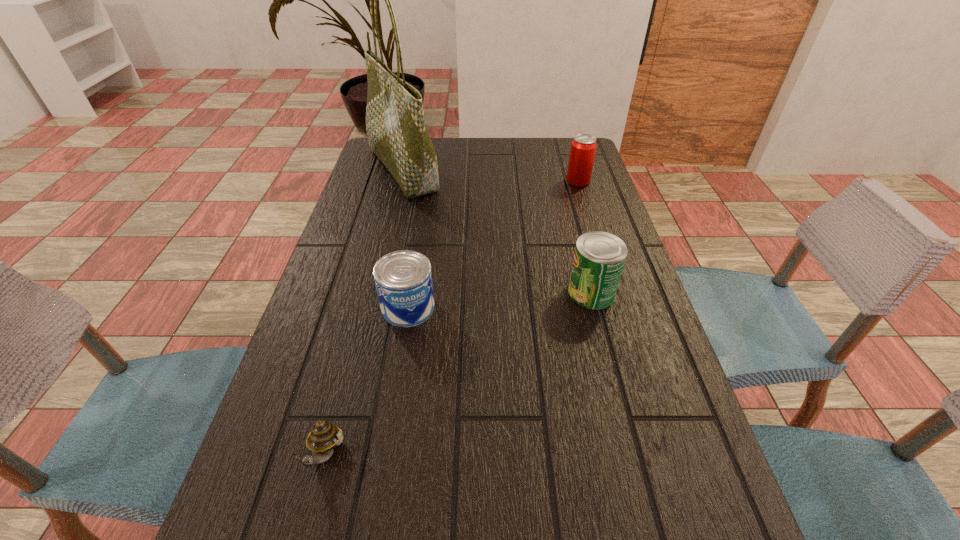
You are a GUI agent. You are given a task and a screenshot of the screen. Output one action in this format:
    pyautogui.click(x=<x>, y=<y>)
    Task: Click on the free space between the tallest object and the farthest can
    The width and height of the screenshot is (960, 540).
    Given the screenshot: What is the action you would take?
    pyautogui.click(x=491, y=175)

The height and width of the screenshot is (540, 960). I want to click on vacant point located between the farthest can and the tallest object, so click(x=491, y=175).

Identify the location of object that can be found as the closest to the shortest can. (324, 436).

Find the location of a particular element. The height and width of the screenshot is (540, 960). object that stands as the closest to the tallest object is located at coordinates (403, 279).

Where is `can that is the closest to the leftmost can`? The height and width of the screenshot is (540, 960). can that is the closest to the leftmost can is located at coordinates (599, 257).

Where is `can that stands as the second closest to the shortest can`? The width and height of the screenshot is (960, 540). can that stands as the second closest to the shortest can is located at coordinates (583, 147).